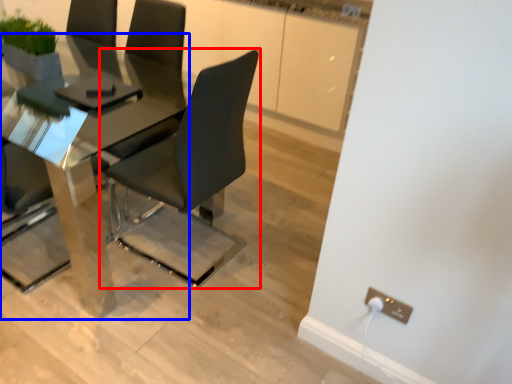
Question: Which of the following is the closest to the observer, chair (highlighted by a red box) or table (highlighted by a blue box)?

Choices:
 (A) chair
 (B) table

Answer: (A)